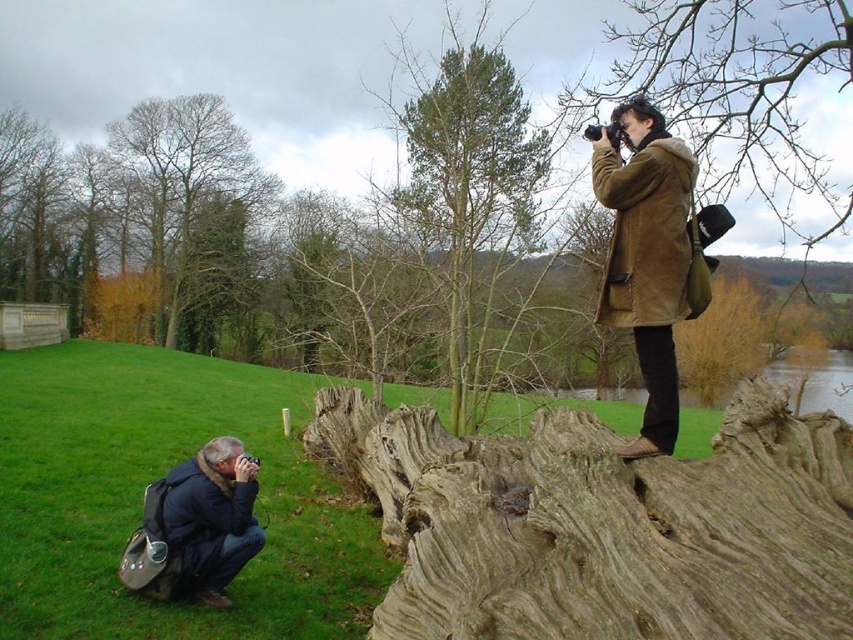
Who is more forward, (413, 588) or (258, 172)?

Positioned in front is point (413, 588).

Looking at this image, can you confirm if weathered wood log at upper center is positioned above brown textured tree trunk at upper left?

No.

Find the location of a particular element. The image size is (853, 640). weathered wood log at upper center is located at coordinates (602, 524).

Between brown textured tree trunk at upper left and brown suede coat at upper right, which one has less height?

With less height is brown suede coat at upper right.

Can you confirm if brown textured tree trunk at upper left is shorter than brown suede coat at upper right?

Incorrect, brown textured tree trunk at upper left's height does not fall short of brown suede coat at upper right's.

The height and width of the screenshot is (640, 853). What do you see at coordinates (195, 209) in the screenshot?
I see `brown textured tree trunk at upper left` at bounding box center [195, 209].

The image size is (853, 640). In order to click on brown textured tree trunk at upper left in this screenshot , I will do `click(195, 209)`.

Does point (659, 76) come closer to viewer compared to point (122, 144)?

Yes, it is.

Which of these two, brown textured coat at upper right or brown textured tree trunk at upper left, stands taller?

brown textured tree trunk at upper left is taller.

Does point (654, 65) come behind point (165, 116)?

No, it is in front of (165, 116).

I want to click on brown textured coat at upper right, so click(x=734, y=90).